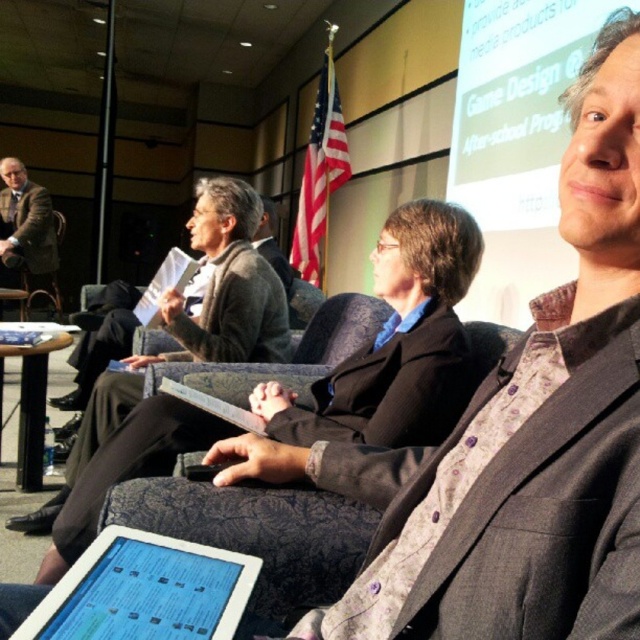
How distant is white glossy tablet at lower left from dark gray wool suit at center?

They are 5.12 feet apart.

Is white glossy tablet at lower left shorter than dark gray wool suit at center?

Correct, white glossy tablet at lower left is not as tall as dark gray wool suit at center.

Is point (202, 557) in front of point (260, 330)?

That is True.

Find the location of a particular element. This screenshot has height=640, width=640. white glossy tablet at lower left is located at coordinates (144, 592).

Which is more to the right, white glossy tablet at lower left or matte brown suit at left?

white glossy tablet at lower left

Who is more distant from viewer, (144, 532) or (8, 180)?

The point (8, 180) is more distant.

Image resolution: width=640 pixels, height=640 pixels. In order to click on white glossy tablet at lower left in this screenshot , I will do `click(144, 592)`.

Between point (465, 577) and point (56, 298), which one is positioned behind?

Point (56, 298)

Is dark gray textured blazer at center below matte brown suit at left?

Yes.

The image size is (640, 640). What do you see at coordinates (513, 499) in the screenshot? I see `dark gray textured blazer at center` at bounding box center [513, 499].

This screenshot has width=640, height=640. Identify the location of dark gray textured blazer at center. (513, 499).